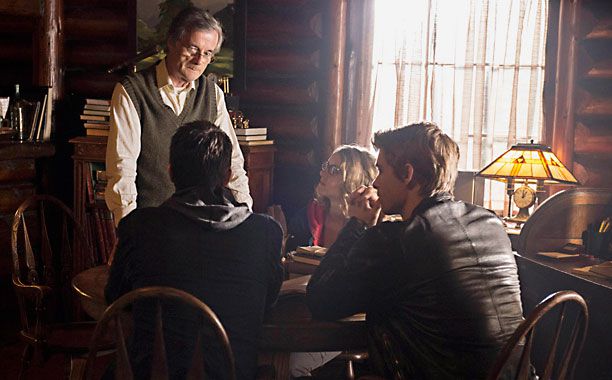
Locate an element on the screen. Image resolution: width=612 pixels, height=380 pixels. clock hands is located at coordinates (521, 191), (524, 193).